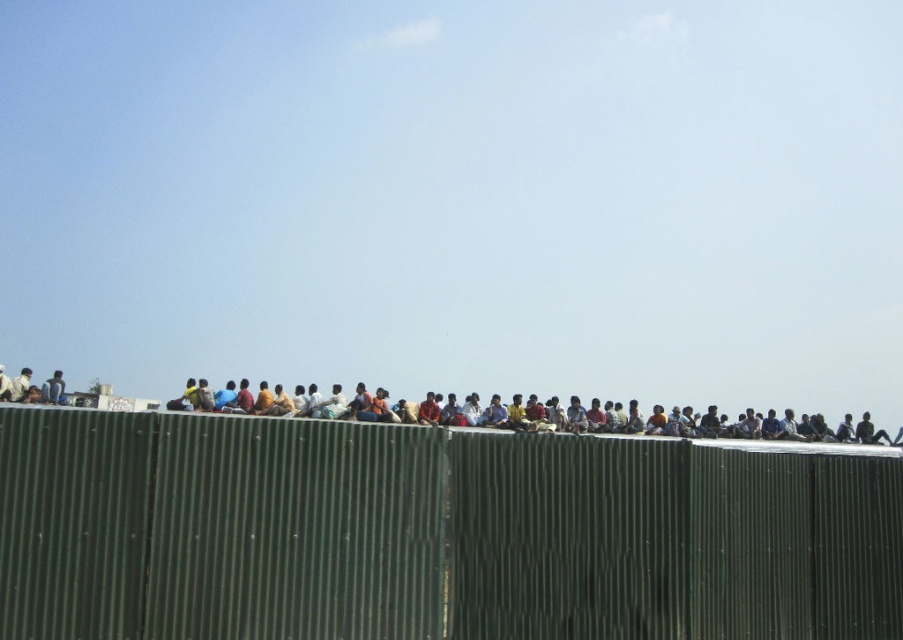
Question: Can you confirm if green corrugated metal fence at center is thinner than dark blue jeans at center?

Choices:
 (A) yes
 (B) no

Answer: (A)

Question: Which point is farther to the camera?

Choices:
 (A) (87, 484)
 (B) (44, 387)

Answer: (B)

Question: Can you confirm if green corrugated metal fence at center is positioned to the left of dark blue jeans at center?

Choices:
 (A) no
 (B) yes

Answer: (A)

Question: Can you confirm if green corrugated metal fence at center is positioned below dark blue jeans at center?

Choices:
 (A) no
 (B) yes

Answer: (A)

Question: Among these points, which one is farthest from the camera?

Choices:
 (A) (51, 388)
 (B) (116, 452)

Answer: (A)

Question: Among these points, which one is nearest to the camera?

Choices:
 (A) (492, 561)
 (B) (44, 394)

Answer: (A)